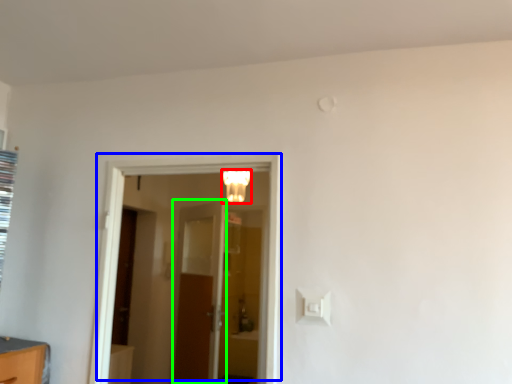
Question: Which is nearer to the light fixture (highlighted by a red box)? door (highlighted by a blue box) or door (highlighted by a green box).

Choices:
 (A) door
 (B) door

Answer: (B)